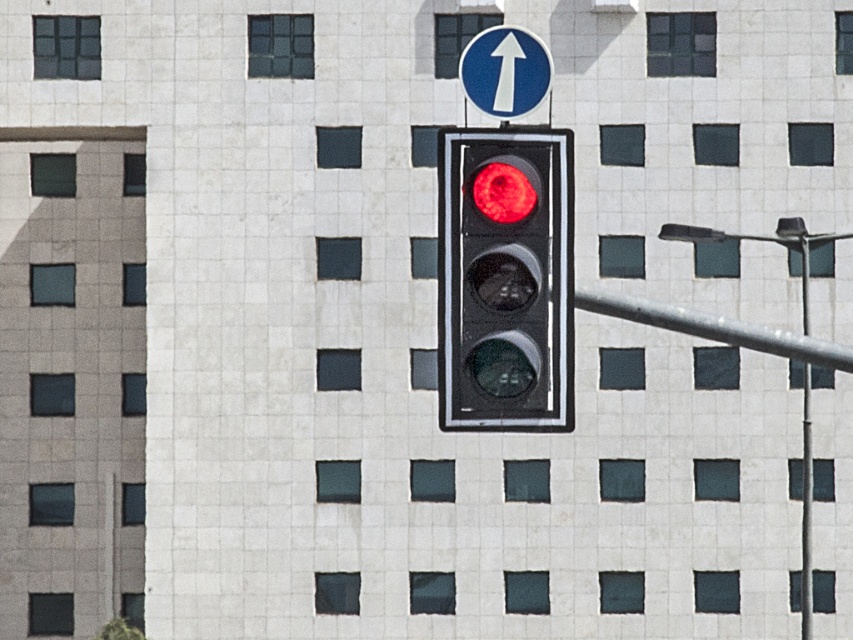
Does matte black traffic light at center have a lesser width compared to blue glossy sign at upper center?

Correct, matte black traffic light at center's width is less than blue glossy sign at upper center's.

Who is higher up, matte black traffic light at center or blue glossy sign at upper center?

Positioned higher is blue glossy sign at upper center.

Locate an element on the screen. matte black traffic light at center is located at coordinates (505, 280).

Who is positioned more to the right, matte black traffic light at center or metallic gray pole at right?

From the viewer's perspective, metallic gray pole at right appears more on the right side.

Can you confirm if matte black traffic light at center is thinner than metallic gray pole at right?

Correct, matte black traffic light at center's width is less than metallic gray pole at right's.

This screenshot has width=853, height=640. What do you see at coordinates (505, 280) in the screenshot?
I see `matte black traffic light at center` at bounding box center [505, 280].

Locate an element on the screen. matte black traffic light at center is located at coordinates (505, 280).

Is metallic gray pole at right smaller than metallic pole at right?

Indeed, metallic gray pole at right has a smaller size compared to metallic pole at right.

Measure the distance between metallic gray pole at right and camera.

22.34 feet

At what (x,y) coordinates should I click in order to perform the action: click on metallic gray pole at right. Please return your answer as a coordinate pair (x, y). This screenshot has width=853, height=640. Looking at the image, I should click on (715, 326).